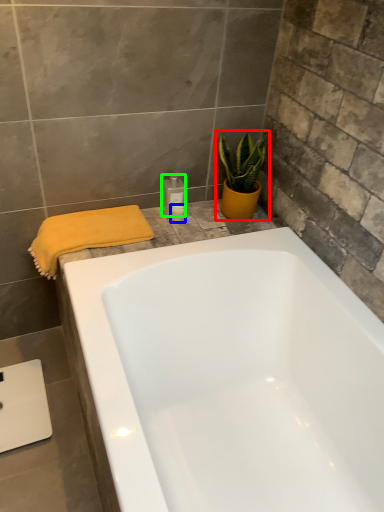
Question: Based on their relative distances, which object is nearer to houseplant (highlighted by a red box)? Choose from toiletry (highlighted by a blue box) and toiletry (highlighted by a green box).

Choices:
 (A) toiletry
 (B) toiletry

Answer: (B)